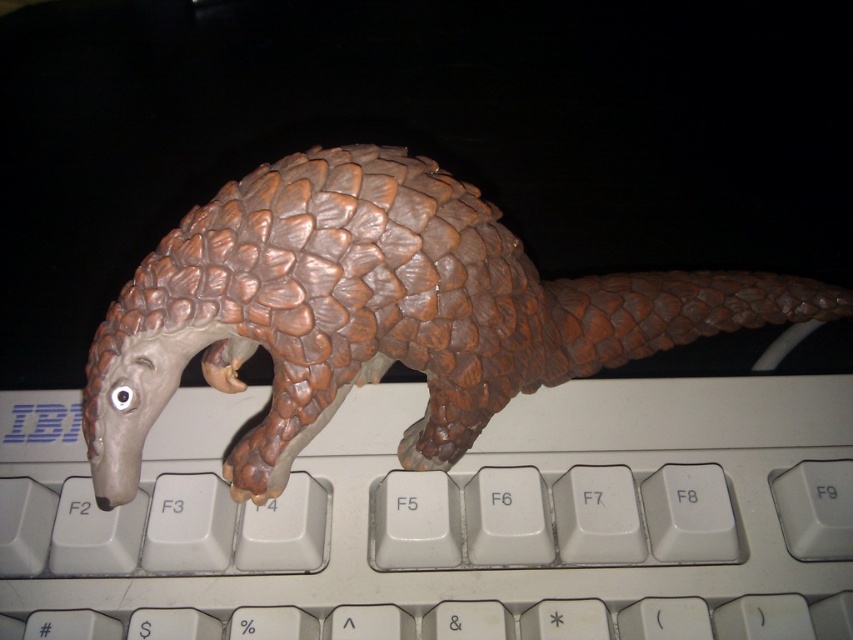
You are trying to type a letter on the keyboard but notice the brown scaly pangolin at center is blocking the white plastic keyboard at center. Which side of the keyboard is the pangolin blocking?

The brown scaly pangolin at center is blocking the right side of the white plastic keyboard at center since it is positioned to the left of the pangolin.

You are a delivery robot that needs to place a small package on the white plastic keyboard at center without disturbing the brown scaly pangolin at center. Can you place the package on the keyboard while maintaining a safe distance of at least 6 inches from the pangolin?

The white plastic keyboard at center is 6.01 inches away from the brown scaly pangolin at center, so yes, the delivery robot can place the package on the keyboard while maintaining a safe distance of at least 6 inches from the pangolin since the distance is slightly more than required.

You are a photographer trying to capture the toy pangolin on the keyboard. You notice two points marked on your camera screen at coordinates point (53, 634) and point (432, 394). Which point is closer to the camera and thus in focus?

Point (53, 634) is closer to the camera than point (432, 394), so it will be in focus.